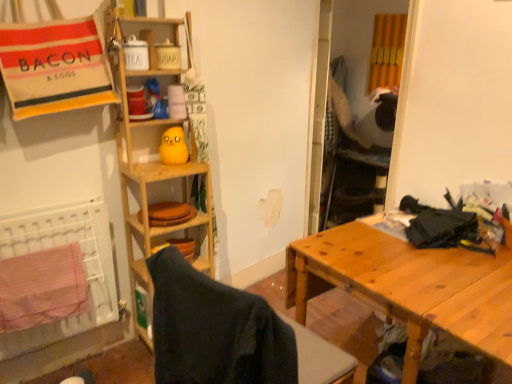
Question: From the image's perspective, is wooden table at right located beneath wooden shelf at center?

Choices:
 (A) yes
 (B) no

Answer: (A)

Question: Can you confirm if wooden table at right is smaller than wooden shelf at center?

Choices:
 (A) no
 (B) yes

Answer: (A)

Question: Does wooden table at right appear on the left side of wooden shelf at center?

Choices:
 (A) yes
 (B) no

Answer: (B)

Question: Is wooden table at right oriented away from wooden shelf at center?

Choices:
 (A) yes
 (B) no

Answer: (B)

Question: Is wooden table at right outside of wooden shelf at center?

Choices:
 (A) no
 (B) yes

Answer: (B)

Question: From a real-world perspective, relative to wooden shelf at center, is wooden folding chair at center vertically above or below?

Choices:
 (A) above
 (B) below

Answer: (B)

Question: Based on their sizes in the image, would you say wooden folding chair at center is bigger or smaller than wooden shelf at center?

Choices:
 (A) small
 (B) big

Answer: (B)

Question: Considering the positions of wooden folding chair at center and wooden shelf at center in the image, is wooden folding chair at center taller or shorter than wooden shelf at center?

Choices:
 (A) tall
 (B) short

Answer: (B)

Question: Relative to wooden shelf at center, is wooden folding chair at center in front or behind?

Choices:
 (A) behind
 (B) front

Answer: (B)

Question: Based on their positions, is wooden shelf at center located to the left or right of wooden folding chair at center?

Choices:
 (A) right
 (B) left

Answer: (B)

Question: From the image's perspective, is wooden shelf at center located above or below wooden folding chair at center?

Choices:
 (A) above
 (B) below

Answer: (A)

Question: Considering the positions of point pos(151,54) and point pos(170,246), is point pos(151,54) closer or farther from the camera than point pos(170,246)?

Choices:
 (A) farther
 (B) closer

Answer: (B)

Question: Is wooden shelf at center bigger or smaller than wooden folding chair at center?

Choices:
 (A) big
 (B) small

Answer: (B)

Question: Which is correct: yellow matte plush toy at upper center is inside wooden shelf at center, or outside of it?

Choices:
 (A) inside
 (B) outside

Answer: (A)

Question: Considering the positions of yellow matte plush toy at upper center and wooden shelf at center in the image, is yellow matte plush toy at upper center wider or thinner than wooden shelf at center?

Choices:
 (A) wide
 (B) thin

Answer: (B)